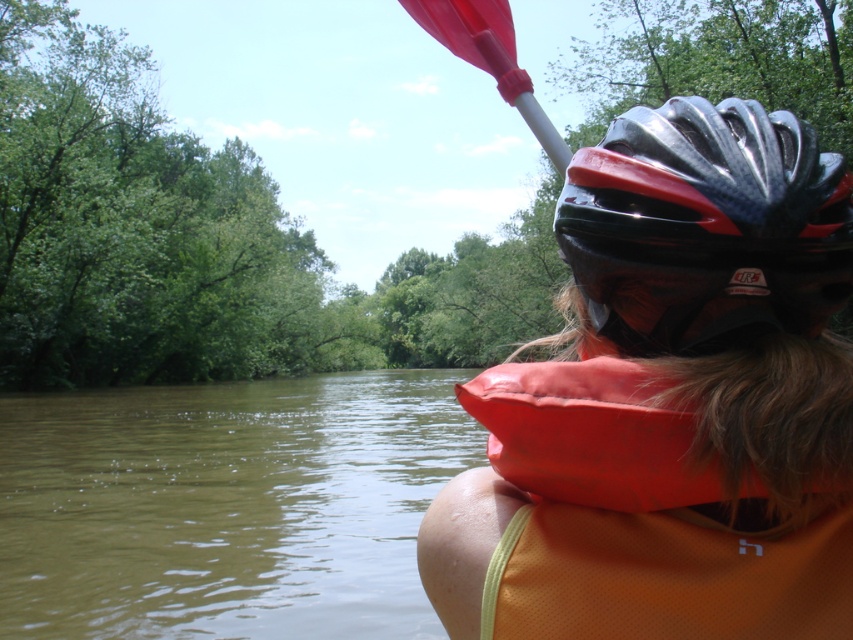
Question: Among these points, which one is nearest to the camera?

Choices:
 (A) (715, 138)
 (B) (490, 524)
 (C) (799, 515)

Answer: (C)

Question: Does brown murky water at lower left have a smaller size compared to rubber paddle at upper center?

Choices:
 (A) yes
 (B) no

Answer: (B)

Question: Which of the following is the farthest from the observer?

Choices:
 (A) shiny black helmet at upper right
 (B) rubber paddle at upper center
 (C) black/glossy bicycle helmet at center

Answer: (B)

Question: Which of the following is the farthest from the observer?

Choices:
 (A) rubber paddle at upper center
 (B) orange fabric life jacket at lower right
 (C) black/glossy bicycle helmet at center

Answer: (A)

Question: Is shiny black helmet at upper right thinner than black/glossy bicycle helmet at center?

Choices:
 (A) no
 (B) yes

Answer: (A)

Question: Is shiny black helmet at upper right smaller than rubber paddle at upper center?

Choices:
 (A) yes
 (B) no

Answer: (A)